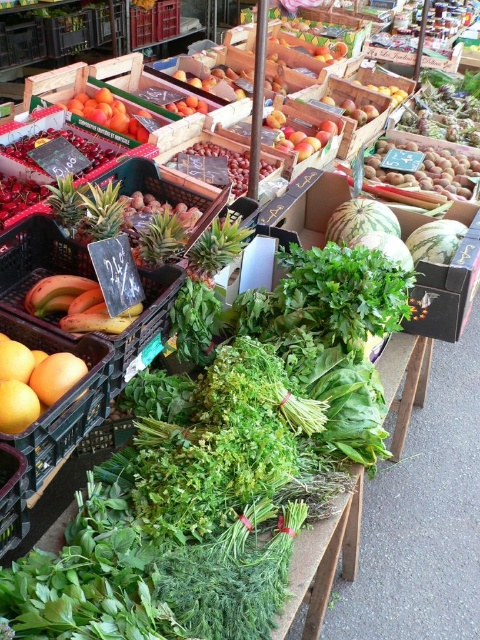
Question: Can you confirm if smooth red apple at center is positioned above smooth yellow mango at center?

Choices:
 (A) yes
 (B) no

Answer: (B)

Question: Does yellow matte bananas at left appear under smooth orange at center?

Choices:
 (A) yes
 (B) no

Answer: (A)

Question: Which point is closer to the camera?

Choices:
 (A) shiny red cherries at center
 (B) smooth orange at center

Answer: (A)

Question: Can you confirm if shiny red cherries at center is smaller than green leafy vegetable at center?

Choices:
 (A) no
 (B) yes

Answer: (A)

Question: Which object appears farthest from the camera in this image?

Choices:
 (A) green leafy vegetable at center
 (B) smooth yellow mango at center
 (C) shiny red apples at center

Answer: (B)

Question: Which of the following is the closest to the observer?

Choices:
 (A) (69, 381)
 (B) (372, 90)
 (C) (170, 104)
 (D) (33, 204)

Answer: (A)